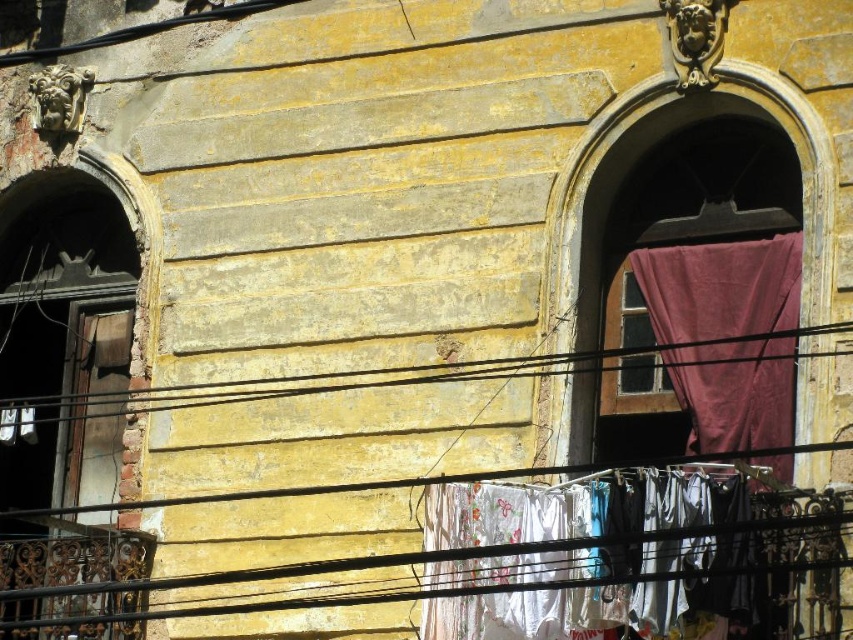
You are standing in front of the old building and notice the white fabric laundry at center and the purple fabric curtain at right. Which object is taller?

The purple fabric curtain at right is taller than the white fabric laundry at center.

You are standing in front of the old building and notice the white fabric laundry at center and the purple fabric curtain at right. Which object is located below the other?

The white fabric laundry at center is positioned under the purple fabric curtain at right.

You are standing at the center of the old building and want to hang a new laundry item. The laundry item is 1.5 meters long. Can you hang it between the white fabric laundry at center and the purple fabric curtain at right without it touching the ground?

The distance between the white fabric laundry at center and the purple fabric curtain at right is 6.40 meters. Since the laundry item is only 1.5 meters long, it would not be long enough to span the 6.40 meter gap. Therefore, you cannot hang it between them without it touching the ground.